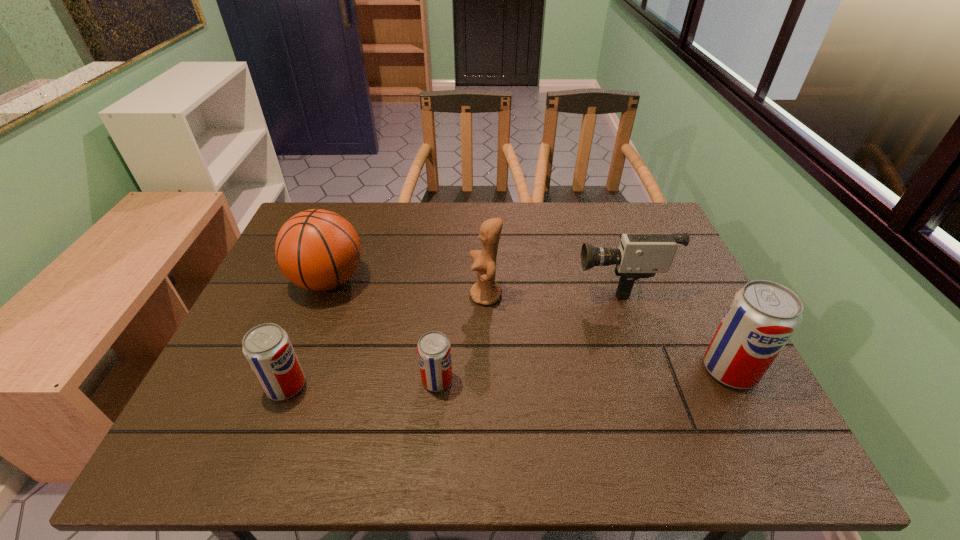
Find the location of a particular element. The width and height of the screenshot is (960, 540). vacant space located on the right of the shortest object is located at coordinates tap(516, 380).

Where is `free space located on the front of the rightmost object`? This screenshot has width=960, height=540. free space located on the front of the rightmost object is located at coordinates (752, 413).

You are a GUI agent. You are given a task and a screenshot of the screen. Output one action in this format:
    pyautogui.click(x=<x>, y=<y>)
    Task: Click on the vacant space located 0.230m on the recording direction of the camcorder
    The width and height of the screenshot is (960, 540).
    Given the screenshot: What is the action you would take?
    pyautogui.click(x=491, y=280)

Identify the location of vacant space located 0.160m on the recording direction of the camcorder. The height and width of the screenshot is (540, 960). pyautogui.click(x=516, y=280).

Where is `free space located on the recording direction of the camcorder`? free space located on the recording direction of the camcorder is located at coordinates (530, 280).

At what (x,y) coordinates should I click in order to perform the action: click on free spot located on the front-facing side of the figurine. Please return your answer as a coordinate pair (x, y). Looking at the image, I should click on (332, 295).

In order to click on blank space located on the front-facing side of the figurine in this screenshot , I will do `click(451, 295)`.

This screenshot has height=540, width=960. What are the coordinates of `vacant space located 0.370m on the front-facing side of the figurine` in the screenshot? It's located at (332, 295).

Locate an element on the screen. The image size is (960, 540). vacant region located 0.130m on the front of the basketball is located at coordinates (303, 348).

This screenshot has height=540, width=960. Identify the location of soda located in the left edge section of the desktop. (267, 347).